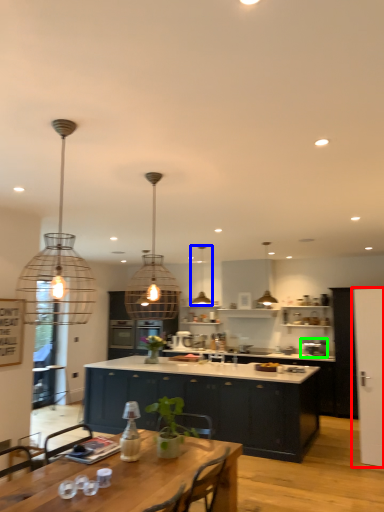
Question: Considering the real-world distances, which object is farthest from glass door (highlighted by a red box)? lamp (highlighted by a blue box) or appliance (highlighted by a green box)?

Choices:
 (A) lamp
 (B) appliance

Answer: (A)